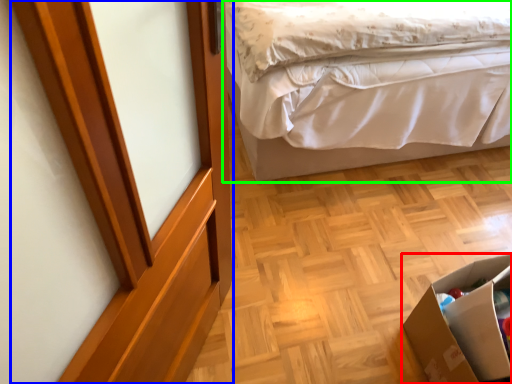
Question: Which object is the farthest from cardboard box (highlighted by a red box)? Choose among these: screen door (highlighted by a blue box) or bed (highlighted by a green box).

Choices:
 (A) screen door
 (B) bed

Answer: (B)